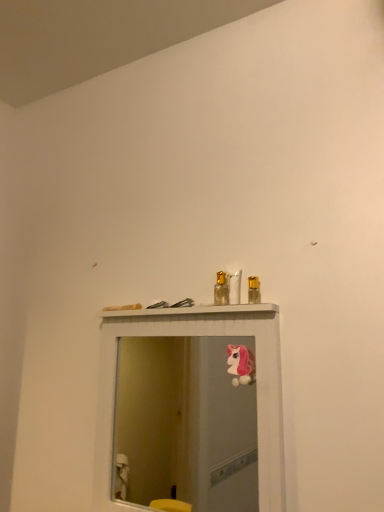
Question: From a real-world perspective, is pink plush unicorn at upper center positioned above or below white glossy mirror at upper center?

Choices:
 (A) below
 (B) above

Answer: (B)

Question: In terms of height, does pink plush unicorn at upper center look taller or shorter compared to white glossy mirror at upper center?

Choices:
 (A) short
 (B) tall

Answer: (A)

Question: Estimate the real-world distances between objects in this image. Which object is closer to the white glossy mirror at upper center?

Choices:
 (A) metallic gold spray can at upper center, which is the 1th toiletry in right-to-left order
 (B) gold metallic perfume bottle at center, arranged as the first toiletry when viewed from the left
 (C) pink plush unicorn at upper center

Answer: (C)

Question: Based on their relative distances, which object is nearer to the gold metallic perfume bottle at center, arranged as the first toiletry when viewed from the left?

Choices:
 (A) pink plush unicorn at upper center
 (B) white glossy mirror at upper center
 (C) metallic gold spray can at upper center, which is the 1th toiletry in right-to-left order

Answer: (C)